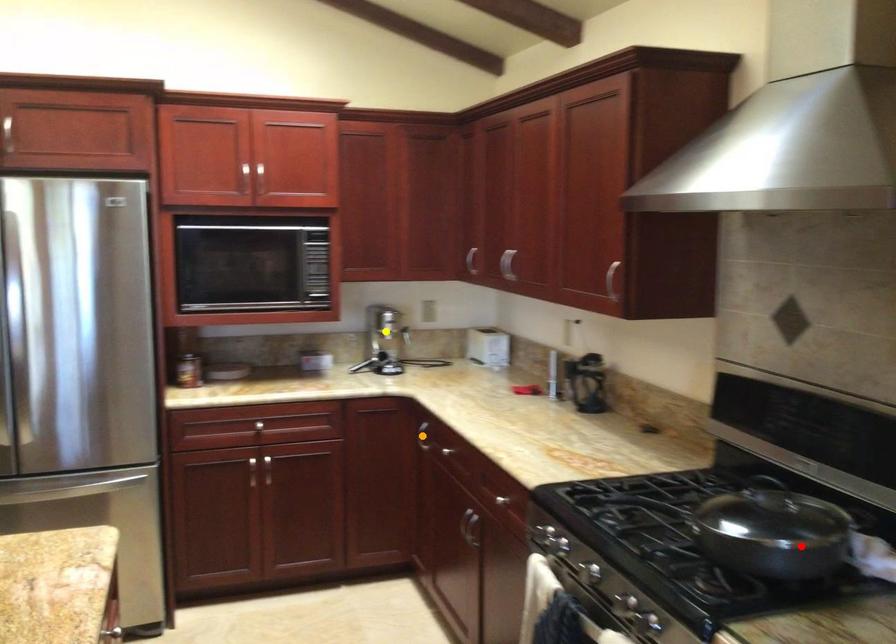
Order these from nearest to farthest:
A) red point
B) yellow point
C) orange point

yellow point
orange point
red point